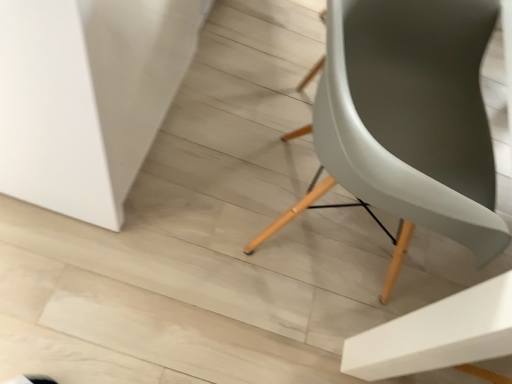
At what (x,y) coordinates should I click in order to perform the action: click on free space underneath matte gray chair at center (from a real-world perspective). Please return your answer as a coordinate pair (x, y). The height and width of the screenshot is (384, 512). Looking at the image, I should click on (305, 225).